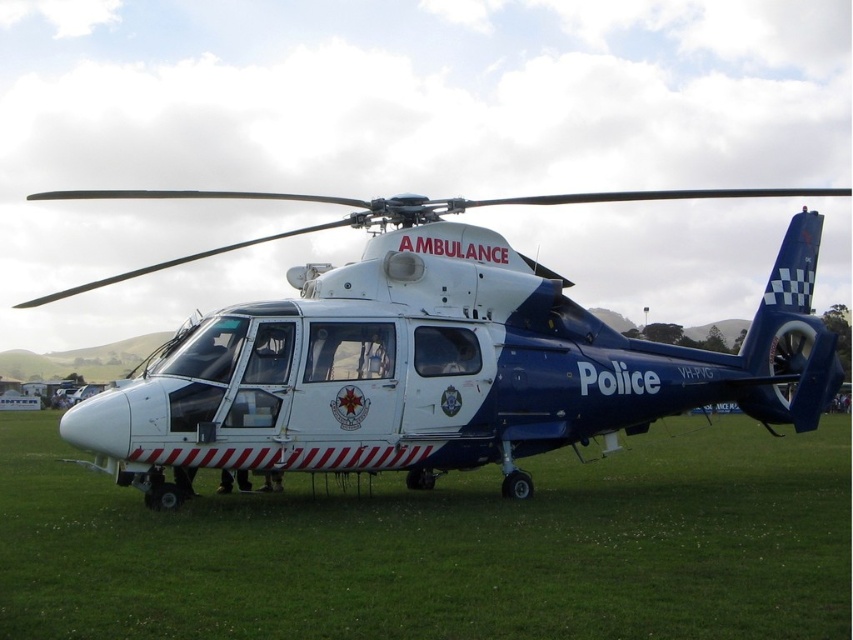
You are standing in front of the police helicopter and want to inspect two points on its body. The first point is at coordinates point (758, 477) and the second is at point (193, 193). Which point will you reach first if you walk towards them from your current position?

Point (758, 477) is closer to the viewer than point (193, 193), so you will reach point (758, 477) first.

You are a drone operator trying to land a small drone on the green grass at lower center. The white glossy helicopter at center is in your flight path. Based on the scene, can you safely land the drone on the grass without hitting the helicopter?

The green grass at lower center is located below the white glossy helicopter at center, so the helicopter is above the grass. Therefore, you can safely land the drone on the green grass at lower center without hitting the helicopter as long as you navigate around or below the helicopter.